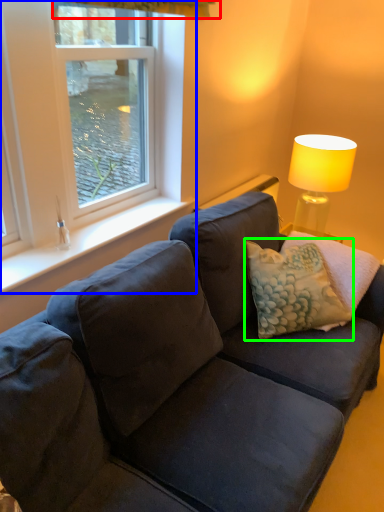
Question: Based on their relative distances, which object is nearer to curtain (highlighted by a red box)? Choose from window (highlighted by a blue box) and pillow (highlighted by a green box).

Choices:
 (A) window
 (B) pillow

Answer: (A)